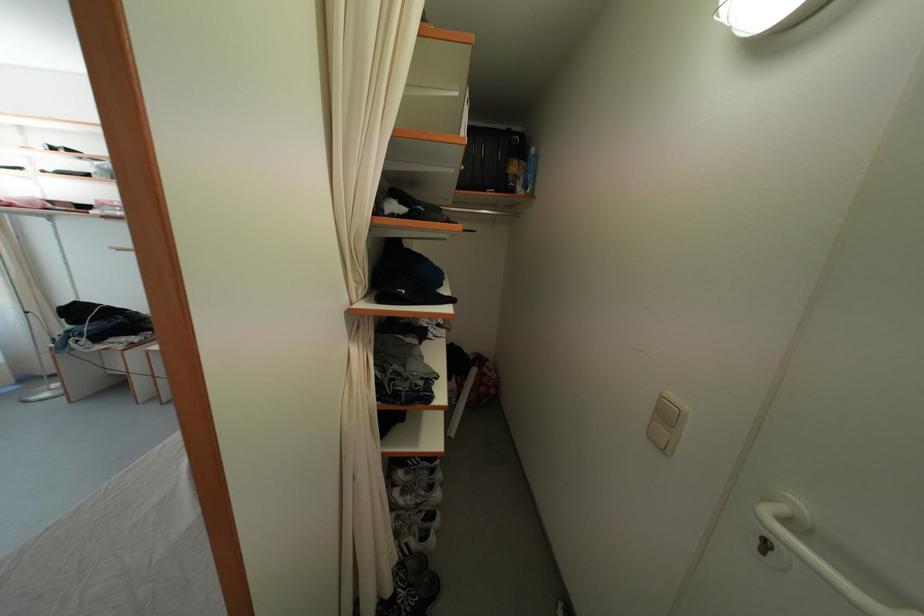
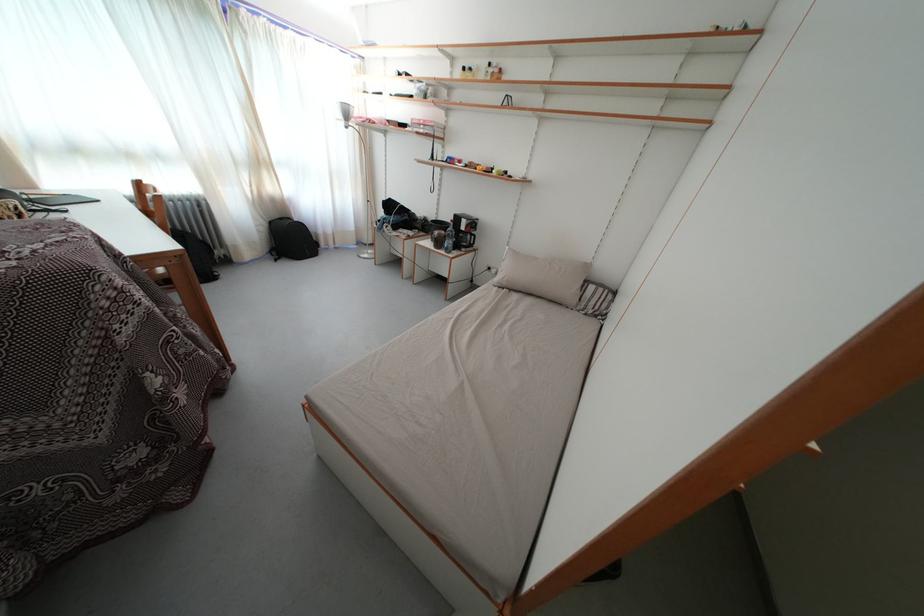
How did the camera likely rotate?

The camera's rotation is toward left-down.